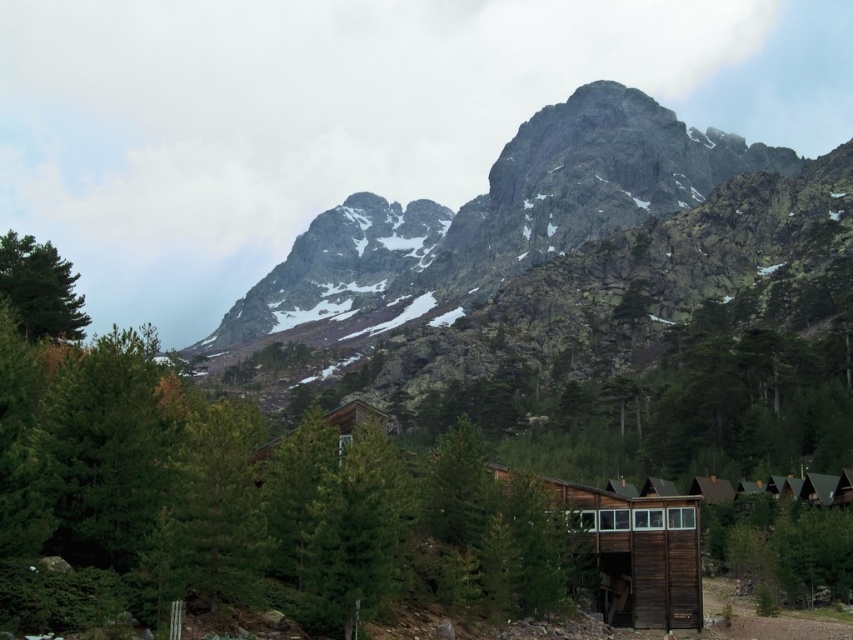
You are an architect designing a new cabin in this mountain area. You notice the green matte tree at upper center and the green matte tree at upper left in the scene. Which tree has a wider spread when viewed from above?

The green matte tree at upper center has a wider spread when viewed from above because its width is larger than that of the green matte tree at upper left.

You are planning to build a hiking trail that starts from the wooden cabin at lower right and leads towards the rocky gray mountain at upper center. Considering their sizes, which structure will appear larger in the trail design blueprint?

The rocky gray mountain at upper center will appear larger in the trail design blueprint because it is bigger than the wooden cabin at lower right.